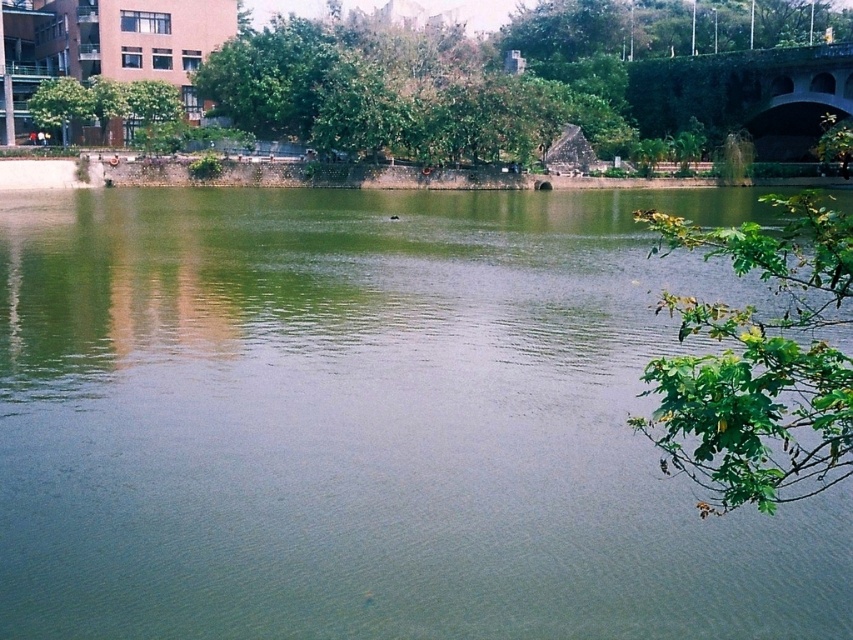
Question: Which of the following is the closest to the observer?

Choices:
 (A) (711, 401)
 (B) (465, 563)

Answer: (A)

Question: Does green leafy branch at right appear on the right side of green concrete bridge at upper right?

Choices:
 (A) no
 (B) yes

Answer: (A)

Question: Estimate the real-world distances between objects in this image. Which object is closer to the green concrete bridge at upper right?

Choices:
 (A) green leafy branch at right
 (B) green smooth water at center
 (C) green leafy tree at upper left

Answer: (A)

Question: Does green leafy branch at right appear under green concrete bridge at upper right?

Choices:
 (A) yes
 (B) no

Answer: (A)

Question: Observing the image, what is the correct spatial positioning of green concrete bridge at upper right in reference to green leafy tree at upper left?

Choices:
 (A) left
 (B) right

Answer: (B)

Question: Among these points, which one is nearest to the camera?

Choices:
 (A) (302, 408)
 (B) (824, 348)
 (C) (86, 97)

Answer: (B)